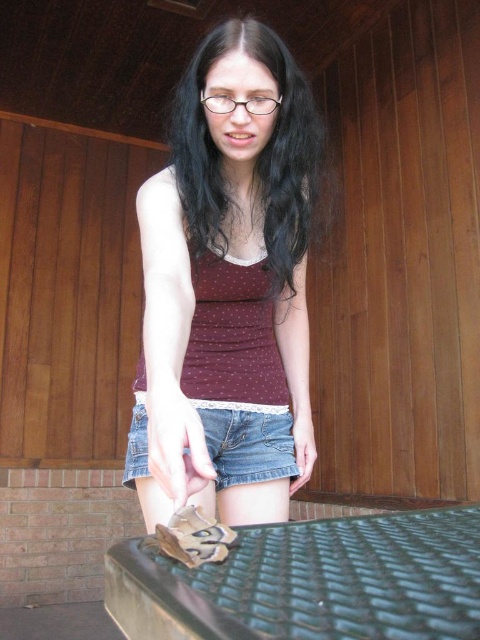
Question: Is black wavy hair at center thinner than matte brown leather hand at lower center?

Choices:
 (A) no
 (B) yes

Answer: (A)

Question: Which of the following is the closest to the observer?

Choices:
 (A) denim shorts at center
 (B) pale skin at center

Answer: (B)

Question: Which object is closer to the camera taking this photo?

Choices:
 (A) denim shorts at center
 (B) matte burgundy tank top at center
 (C) pale skin at center
 (D) black wavy hair at center

Answer: (B)

Question: Which point is farther to the camera?

Choices:
 (A) matte burgundy tank top at center
 (B) denim shorts at center
 (C) pale skin at center
 (D) black wavy hair at center

Answer: (D)

Question: Is matte burgundy tank top at center positioned at the back of denim shorts at center?

Choices:
 (A) no
 (B) yes

Answer: (A)

Question: Does matte burgundy tank top at center have a larger size compared to black wavy hair at center?

Choices:
 (A) no
 (B) yes

Answer: (B)